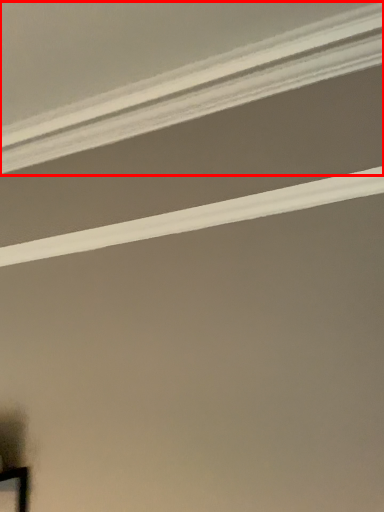
Question: Considering the relative positions of strip (annotated by the red box) and strip in the image provided, where is strip (annotated by the red box) located with respect to the staircase?

Choices:
 (A) right
 (B) left

Answer: (B)